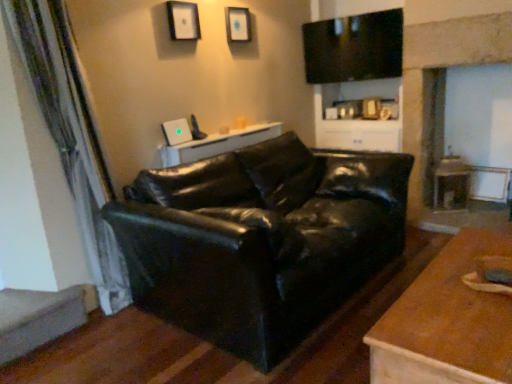
Question: Is green textured curtain at left touching matte white picture frame at upper center, positioned as the 1th picture frame in back-to-front order?

Choices:
 (A) no
 (B) yes

Answer: (A)

Question: Is green textured curtain at left looking in the opposite direction of matte white picture frame at upper center, the second picture frame viewed from the front?

Choices:
 (A) yes
 (B) no

Answer: (B)

Question: Does green textured curtain at left appear on the right side of matte white picture frame at upper center, the first picture frame when ordered from right to left?

Choices:
 (A) yes
 (B) no

Answer: (B)

Question: Is the position of green textured curtain at left more distant than that of matte white picture frame at upper center, the second picture frame viewed from the front?

Choices:
 (A) yes
 (B) no

Answer: (B)

Question: Does green textured curtain at left have a lesser width compared to matte white picture frame at upper center, the first picture frame when ordered from right to left?

Choices:
 (A) yes
 (B) no

Answer: (B)

Question: From the image's perspective, would you say green textured curtain at left is shown under matte white picture frame at upper center, positioned as the 1th picture frame in back-to-front order?

Choices:
 (A) yes
 (B) no

Answer: (A)

Question: From a real-world perspective, is white glossy table at center, placed as the second table when sorted from front to back, over matte black entertainment center at upper center?

Choices:
 (A) yes
 (B) no

Answer: (B)

Question: Considering the relative sizes of white glossy table at center, positioned as the 1th table in left-to-right order, and matte black entertainment center at upper center in the image provided, is white glossy table at center, positioned as the 1th table in left-to-right order, shorter than matte black entertainment center at upper center?

Choices:
 (A) no
 (B) yes

Answer: (B)

Question: From a real-world perspective, is white glossy table at center, placed as the second table when sorted from front to back, positioned under matte black entertainment center at upper center based on gravity?

Choices:
 (A) no
 (B) yes

Answer: (B)

Question: From the image's perspective, does white glossy table at center, placed as the second table when sorted from bottom to top, appear higher than matte black entertainment center at upper center?

Choices:
 (A) no
 (B) yes

Answer: (A)

Question: Does white glossy table at center, positioned as the 1th table in left-to-right order, have a greater width compared to matte black entertainment center at upper center?

Choices:
 (A) no
 (B) yes

Answer: (A)

Question: Is white glossy table at center, placed as the second table when sorted from front to back, completely or partially outside of matte black entertainment center at upper center?

Choices:
 (A) yes
 (B) no

Answer: (A)

Question: From a real-world perspective, does matte white picture frame at upper center, positioned as the 1th picture frame in back-to-front order, sit lower than matte black entertainment center at upper center?

Choices:
 (A) yes
 (B) no

Answer: (B)